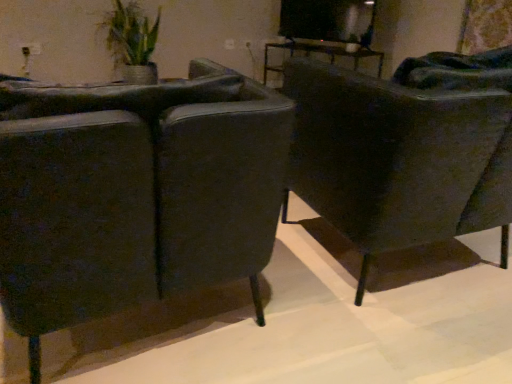
Question: Is matte black chair at right, the second chair in the left-to-right sequence, far away from green woven basket at upper left?

Choices:
 (A) no
 (B) yes

Answer: (B)

Question: Is matte black chair at right, the second chair in the left-to-right sequence, oriented towards green woven basket at upper left?

Choices:
 (A) no
 (B) yes

Answer: (B)

Question: Is matte black chair at right, the second chair in the left-to-right sequence, smaller than green woven basket at upper left?

Choices:
 (A) yes
 (B) no

Answer: (B)

Question: Could green woven basket at upper left be considered to be inside matte black chair at right, the second chair in the left-to-right sequence?

Choices:
 (A) yes
 (B) no

Answer: (B)

Question: Can you confirm if matte black chair at right, the 1th chair when ordered from right to left, is shorter than green woven basket at upper left?

Choices:
 (A) yes
 (B) no

Answer: (B)

Question: Is matte black chair at right, the second chair in the left-to-right sequence, placed right next to green woven basket at upper left?

Choices:
 (A) no
 (B) yes

Answer: (A)

Question: Can matte black chair at right, the 1th chair when ordered from right to left, be found inside green woven basket at upper left?

Choices:
 (A) no
 (B) yes

Answer: (A)

Question: Considering the relative sizes of green woven basket at upper left and matte black chair at right, the 1th chair when ordered from right to left, in the image provided, is green woven basket at upper left shorter than matte black chair at right, the 1th chair when ordered from right to left,?

Choices:
 (A) yes
 (B) no

Answer: (A)

Question: Considering the relative sizes of green woven basket at upper left and matte black chair at right, the 1th chair when ordered from right to left, in the image provided, is green woven basket at upper left wider than matte black chair at right, the 1th chair when ordered from right to left,?

Choices:
 (A) no
 (B) yes

Answer: (A)

Question: From the image's perspective, would you say green woven basket at upper left is positioned over matte black chair at right, the 1th chair when ordered from right to left?

Choices:
 (A) yes
 (B) no

Answer: (A)

Question: Does green woven basket at upper left have a larger size compared to matte black chair at right, the 1th chair when ordered from right to left?

Choices:
 (A) yes
 (B) no

Answer: (B)

Question: Is green woven basket at upper left closer to the viewer compared to matte black chair at right, the 1th chair when ordered from right to left?

Choices:
 (A) yes
 (B) no

Answer: (B)

Question: Is green woven basket at upper left not near matte black chair at left, the 1th chair viewed from the left?

Choices:
 (A) no
 (B) yes

Answer: (B)